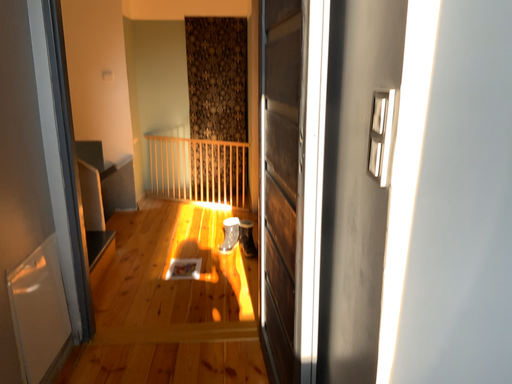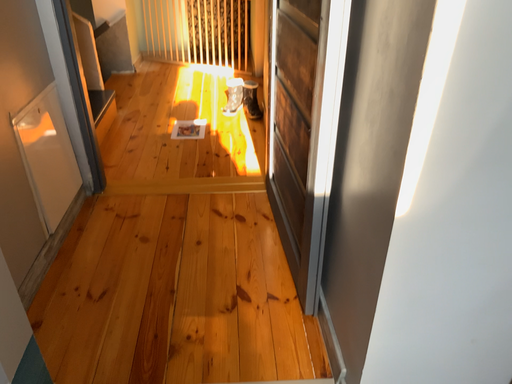
Question: Which way did the camera rotate in the video?

Choices:
 (A) rotated downward
 (B) rotated upward

Answer: (A)